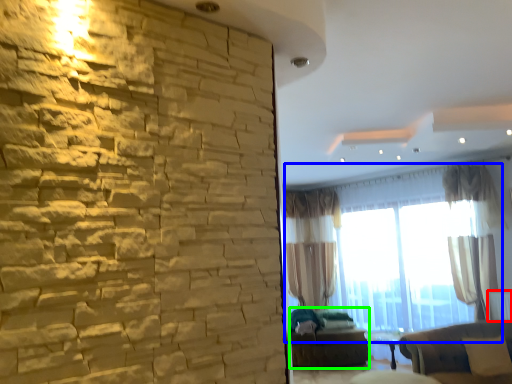
Question: Estimate the real-world distances between objects in this image. Which object is farther from radiator (highlighted by a red box), window (highlighted by a blue box) or futon (highlighted by a green box)?

Choices:
 (A) window
 (B) futon

Answer: (B)